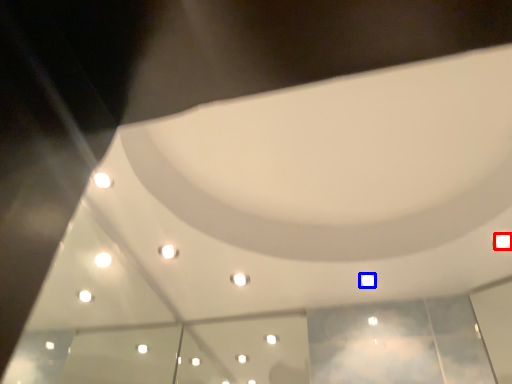
Question: Which object appears farthest to the camera in this image, light (highlighted by a red box) or light (highlighted by a blue box)?

Choices:
 (A) light
 (B) light

Answer: (B)